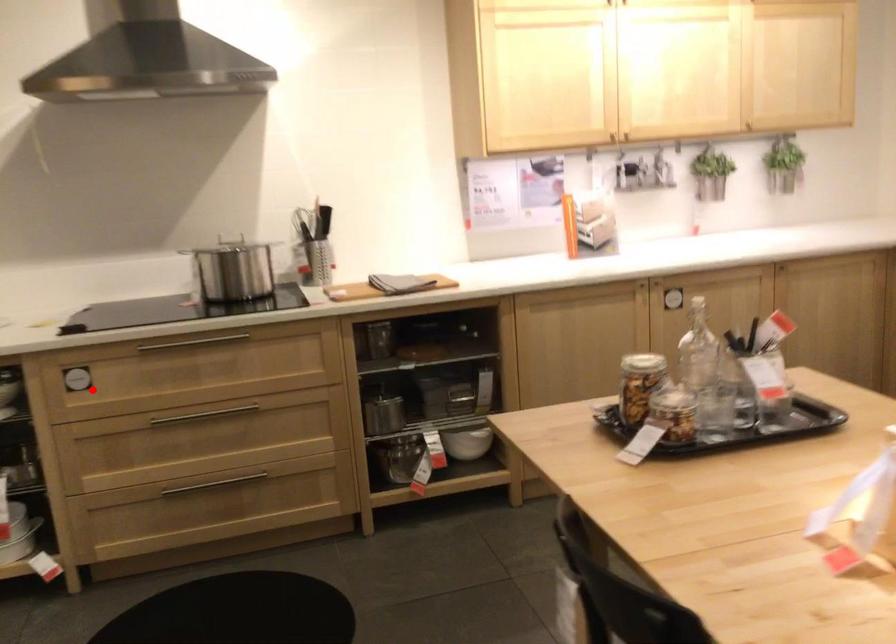
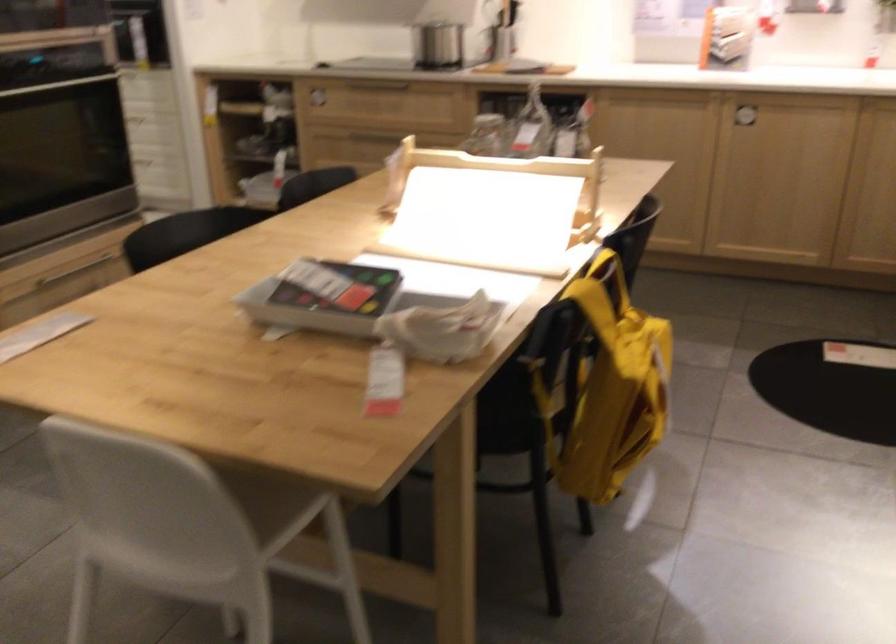
Question: I am providing you with two images of the same scene from different viewpoints. Given a red point in image1, look at the same physical point in image2. Is it:

Choices:
 (A) Closer to the viewpoint
 (B) Farther from the viewpoint

Answer: (B)